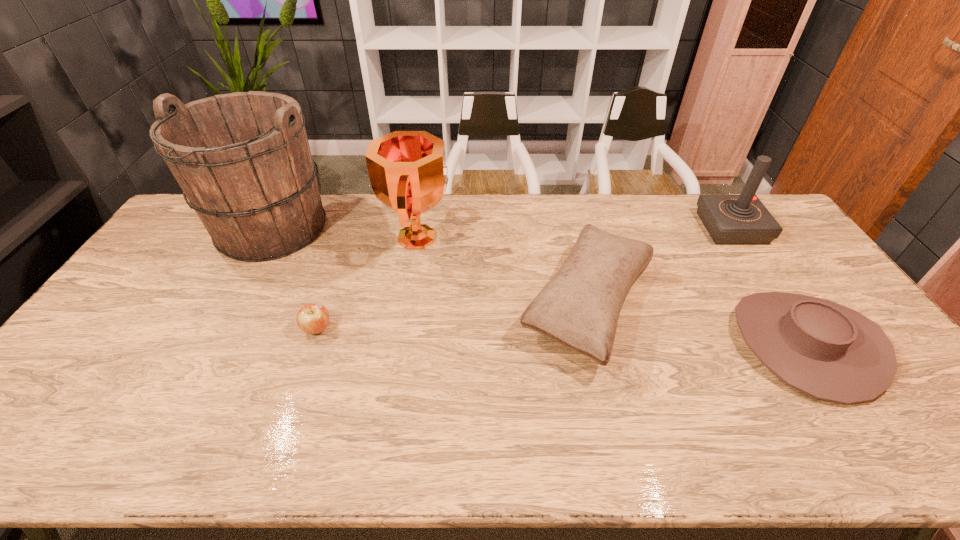
Locate an element on the screen. Image resolution: width=960 pixels, height=540 pixels. joystick situated at the far edge is located at coordinates (742, 219).

What are the coordinates of `object that is at the left edge` in the screenshot? It's located at (242, 159).

The image size is (960, 540). I want to click on joystick present at the right edge, so click(x=742, y=219).

Find the location of `cowboy hat that is at the right edge`. cowboy hat that is at the right edge is located at coordinates (830, 352).

The image size is (960, 540). In order to click on object situated at the far left corner in this screenshot , I will do [x=242, y=159].

At what (x,y) coordinates should I click in order to perform the action: click on object that is at the far right corner. Please return your answer as a coordinate pair (x, y). This screenshot has height=540, width=960. Looking at the image, I should click on (742, 219).

The width and height of the screenshot is (960, 540). In order to click on vacant space at the far edge of the desktop in this screenshot , I will do `click(617, 233)`.

In the image, there is a desktop. At what (x,y) coordinates should I click in order to perform the action: click on free region at the near edge. Please return your answer as a coordinate pair (x, y). Image resolution: width=960 pixels, height=540 pixels. Looking at the image, I should click on (756, 461).

In the image, there is a desktop. Where is `vacant space at the left edge`? vacant space at the left edge is located at coordinates (174, 295).

Where is `free location at the right edge`? The width and height of the screenshot is (960, 540). free location at the right edge is located at coordinates (816, 281).